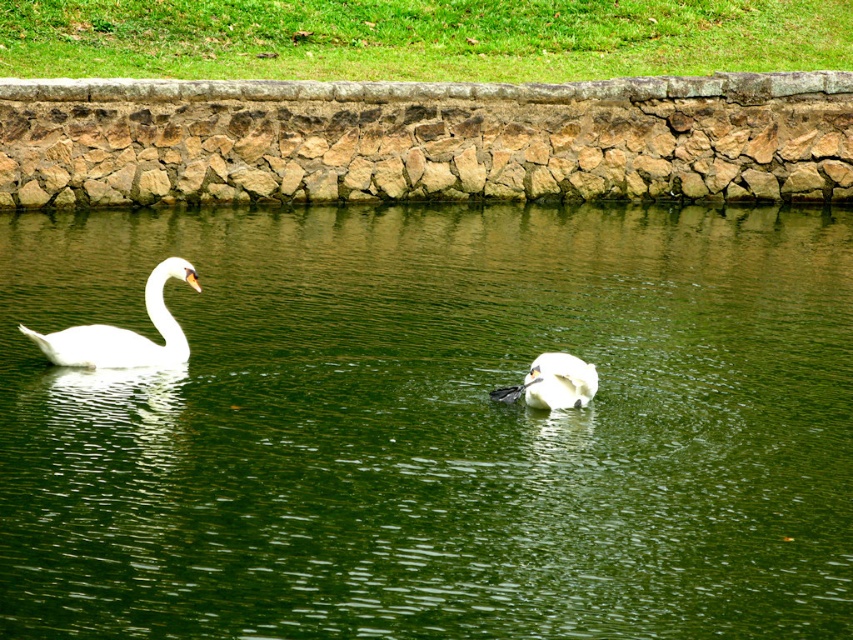
Looking at this image, which of these two, white glossy swan at left or white matte swan at center, stands taller?

Standing taller between the two is white glossy swan at left.

Who is lower down, white glossy swan at left or white matte swan at center?

white matte swan at center

Who is more distant from viewer, (x=108, y=324) or (x=527, y=394)?

Point (x=108, y=324)

This screenshot has height=640, width=853. Find the location of `white glossy swan at left`. white glossy swan at left is located at coordinates (125, 332).

Is point (515, 280) closer to viewer compared to point (579, 390)?

No, it is behind (579, 390).

Does green liquid water at center have a larger size compared to white matte swan at center?

Yes, green liquid water at center is bigger than white matte swan at center.

At what (x,y) coordinates should I click in order to perform the action: click on green liquid water at center. Please return your answer as a coordinate pair (x, y). The height and width of the screenshot is (640, 853). Looking at the image, I should click on (432, 424).

Is green liquid water at center below white glossy swan at left?

Incorrect, green liquid water at center is not positioned below white glossy swan at left.

Does green liquid water at center appear on the left side of white glossy swan at left?

In fact, green liquid water at center is to the right of white glossy swan at left.

Find the location of a particular element. This screenshot has height=640, width=853. green liquid water at center is located at coordinates (432, 424).